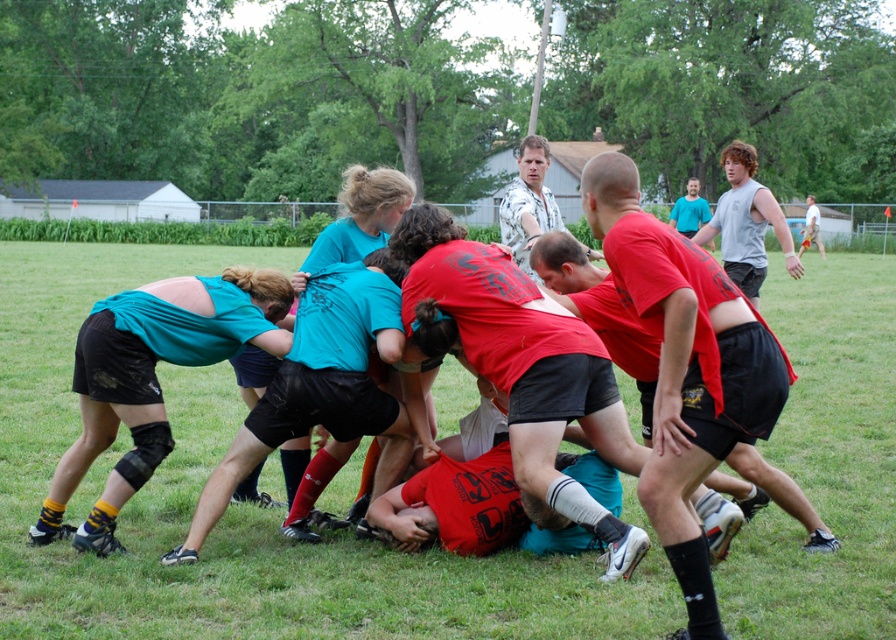
You are a referee observing the rugby scrum. You notice the green grass at center and the matte teal shirt at center. Which object is located above the other?

The green grass at center is positioned over matte teal shirt at center, meaning the grass is above the shirt.